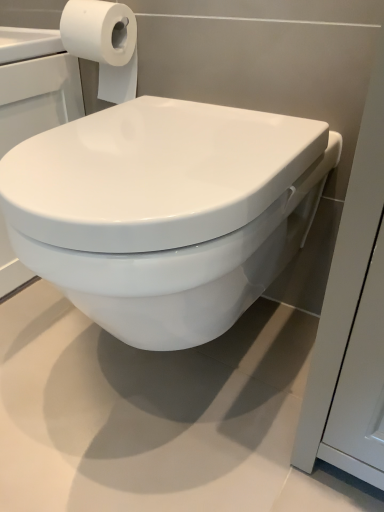
Question: Considering the relative positions of white glossy toilet at center and white matte toilet paper at upper left in the image provided, is white glossy toilet at center to the left of white matte toilet paper at upper left from the viewer's perspective?

Choices:
 (A) no
 (B) yes

Answer: (A)

Question: Is white glossy toilet at center positioned beyond the bounds of white matte toilet paper at upper left?

Choices:
 (A) no
 (B) yes

Answer: (B)

Question: Can you confirm if white glossy toilet at center is taller than white matte toilet paper at upper left?

Choices:
 (A) no
 (B) yes

Answer: (B)

Question: Does white glossy toilet at center touch white matte toilet paper at upper left?

Choices:
 (A) yes
 (B) no

Answer: (B)

Question: From a real-world perspective, is white glossy toilet at center on top of white matte toilet paper at upper left?

Choices:
 (A) yes
 (B) no

Answer: (B)

Question: From the image's perspective, is white glossy toilet at center located above white matte toilet paper at upper left?

Choices:
 (A) no
 (B) yes

Answer: (A)

Question: From the image's perspective, would you say white matte toilet paper at upper left is shown under white glossy toilet at center?

Choices:
 (A) no
 (B) yes

Answer: (A)

Question: Is white matte toilet paper at upper left further to the viewer compared to white glossy toilet at center?

Choices:
 (A) no
 (B) yes

Answer: (B)

Question: Is white matte toilet paper at upper left in front of white glossy toilet at center?

Choices:
 (A) no
 (B) yes

Answer: (A)

Question: From a real-world perspective, is white matte toilet paper at upper left over white glossy toilet at center?

Choices:
 (A) no
 (B) yes

Answer: (B)

Question: Is white matte toilet paper at upper left to the left of white glossy toilet at center from the viewer's perspective?

Choices:
 (A) yes
 (B) no

Answer: (A)

Question: Could white glossy toilet at center be considered to be inside white matte toilet paper at upper left?

Choices:
 (A) no
 (B) yes

Answer: (A)

Question: Which is correct: white matte toilet paper at upper left is inside white glossy toilet at center, or outside of it?

Choices:
 (A) inside
 (B) outside

Answer: (B)